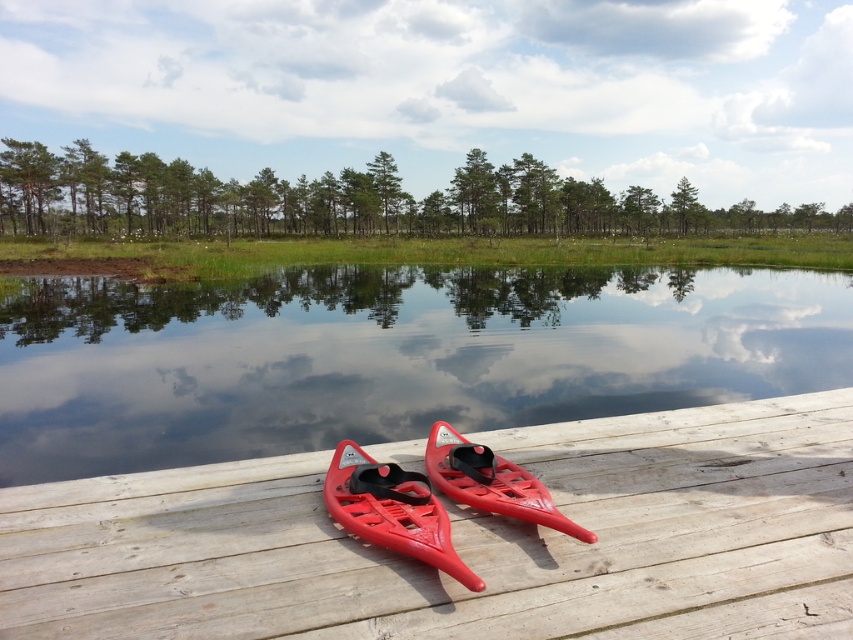
You are standing on the wooden dock and want to reach the glossy plastic canoe at center. The transparent water at center is between you and the canoe. If you can jump 6 meters, will you be able to reach the canoe?

The transparent water at center is 7.09 meters away from the glossy plastic canoe at center. Since your jump can only cover 6 meters, you won not be able to reach the canoe.

You are standing on the wooden dock and want to see if the transparent water at center is deeper than the glossy plastic canoe at center. Based on the scene, can you determine which one is taller?

The transparent water at center is much taller than the glossy plastic canoe at center according to the description.